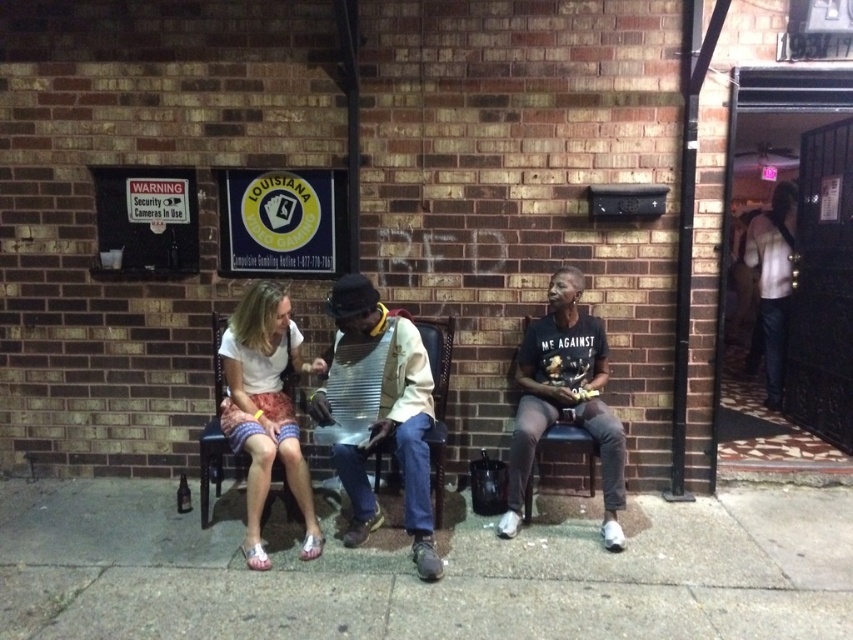
You are a delivery person who needs to place a small box between the metallic washboard at center and the white fabric skirt at center. Can you fit the box there without moving either object?

The metallic washboard at center is wider than the white fabric skirt at center, so there is space between them. The box can be placed there without moving either object.